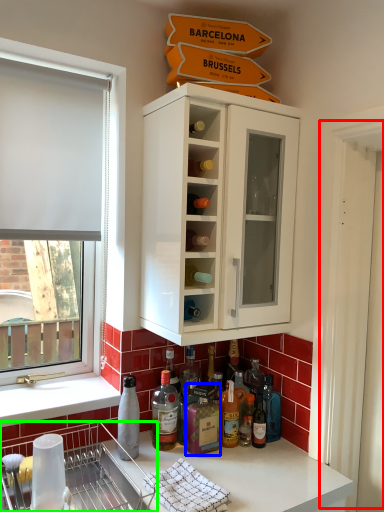
Question: Which is farther away from screen door (highlighted by a red box)? bottle (highlighted by a blue box) or dish washer (highlighted by a green box)?

Choices:
 (A) bottle
 (B) dish washer

Answer: (B)